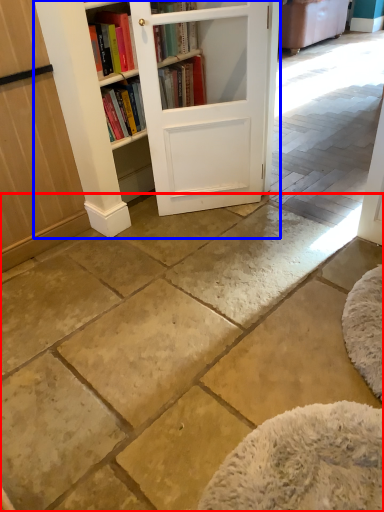
Question: Among these objects, which one is nearest to the camera, concrete (highlighted by a red box) or bookcase (highlighted by a blue box)?

Choices:
 (A) concrete
 (B) bookcase

Answer: (A)